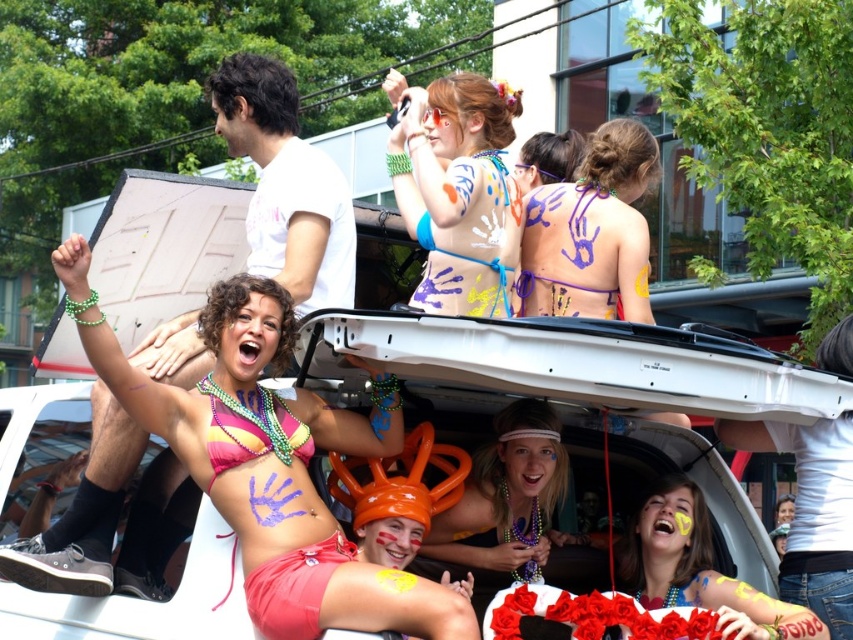
Question: Does pink matte bikini top at center appear over matte pink bikini at center?

Choices:
 (A) yes
 (B) no

Answer: (A)

Question: Is pink matte bikini top at center wider than purple painted hands at center?

Choices:
 (A) yes
 (B) no

Answer: (A)

Question: Which object is closer to the camera taking this photo?

Choices:
 (A) pink matte bikini top at center
 (B) purple painted hands at center

Answer: (A)

Question: Considering the real-world distances, which object is farthest from the purple painted hands at center?

Choices:
 (A) matte orange balloon at center
 (B) multicolored beaded bikini top at center
 (C) pink matte bikini top at center

Answer: (B)

Question: Estimate the real-world distances between objects in this image. Which object is farther from the matte orange balloon at center?

Choices:
 (A) pink matte bikini top at center
 (B) multicolored beaded bikini top at center

Answer: (B)

Question: Does matte blue bikini top at center have a greater width compared to white matte car at center?

Choices:
 (A) yes
 (B) no

Answer: (B)